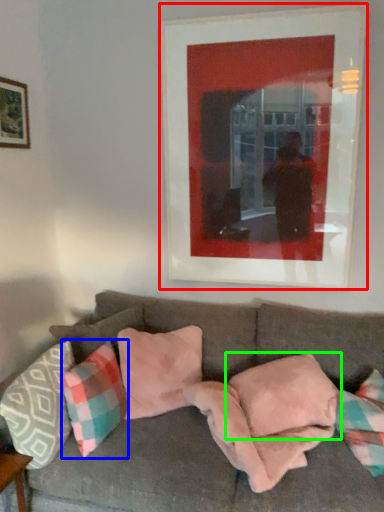
Question: Based on their relative distances, which object is farther from picture frame (highlighted by a red box)? Choose from pillow (highlighted by a blue box) and pillow (highlighted by a green box).

Choices:
 (A) pillow
 (B) pillow

Answer: (A)